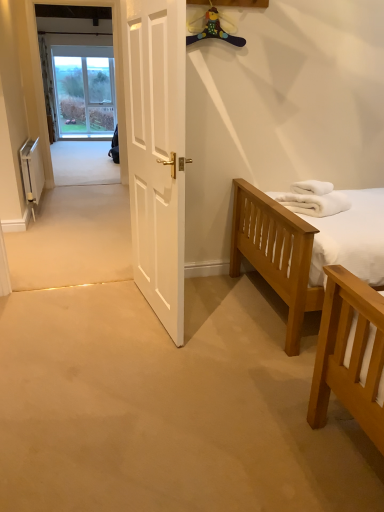
Question: From the image's perspective, is white metallic radiator at left positioned above or below white matte door at center?

Choices:
 (A) below
 (B) above

Answer: (B)

Question: Is point [29, 196] positioned closer to the camera than point [178, 202]?

Choices:
 (A) closer
 (B) farther

Answer: (B)

Question: Based on their relative distances, which object is farther from the white fluffy towels at right?

Choices:
 (A) white metallic radiator at left
 (B) white matte door at center

Answer: (A)

Question: Which object is positioned farthest from the white matte door at center?

Choices:
 (A) white fluffy towels at right
 (B) white metallic radiator at left

Answer: (B)